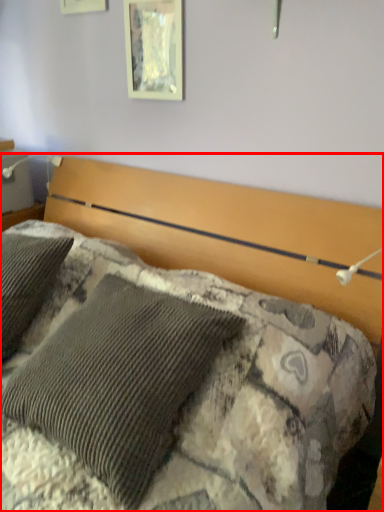
Question: From the image's perspective, where is bed (annotated by the red box) located in relation to picture frame in the image?

Choices:
 (A) below
 (B) above

Answer: (A)